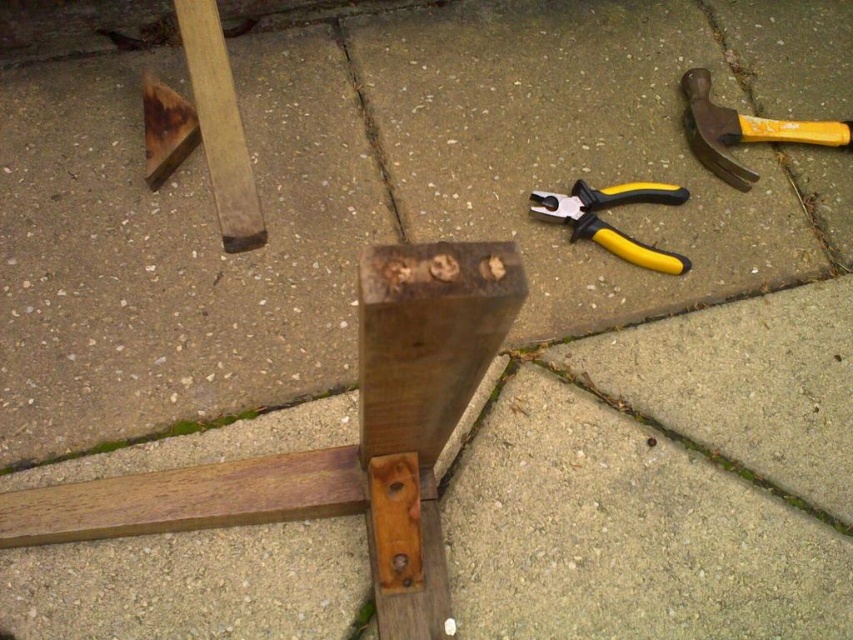
Question: Is brown wood plank at upper left below yellow plastic pliers at center?

Choices:
 (A) no
 (B) yes

Answer: (A)

Question: Can you confirm if natural wood post at center is smaller than yellow rubber hammer at upper right?

Choices:
 (A) no
 (B) yes

Answer: (A)

Question: Is brown wood plank at upper left below yellow plastic pliers at center?

Choices:
 (A) yes
 (B) no

Answer: (B)

Question: Which object appears closest to the camera in this image?

Choices:
 (A) natural wood post at center
 (B) yellow rubber hammer at upper right
 (C) brown wood plank at upper left

Answer: (A)

Question: Which is farther from the yellow plastic pliers at center?

Choices:
 (A) brown wood plank at upper left
 (B) yellow rubber hammer at upper right

Answer: (A)

Question: Based on their relative distances, which object is farther from the yellow rubber hammer at upper right?

Choices:
 (A) brown wood plank at upper left
 (B) natural wood post at center
 (C) yellow plastic pliers at center

Answer: (A)